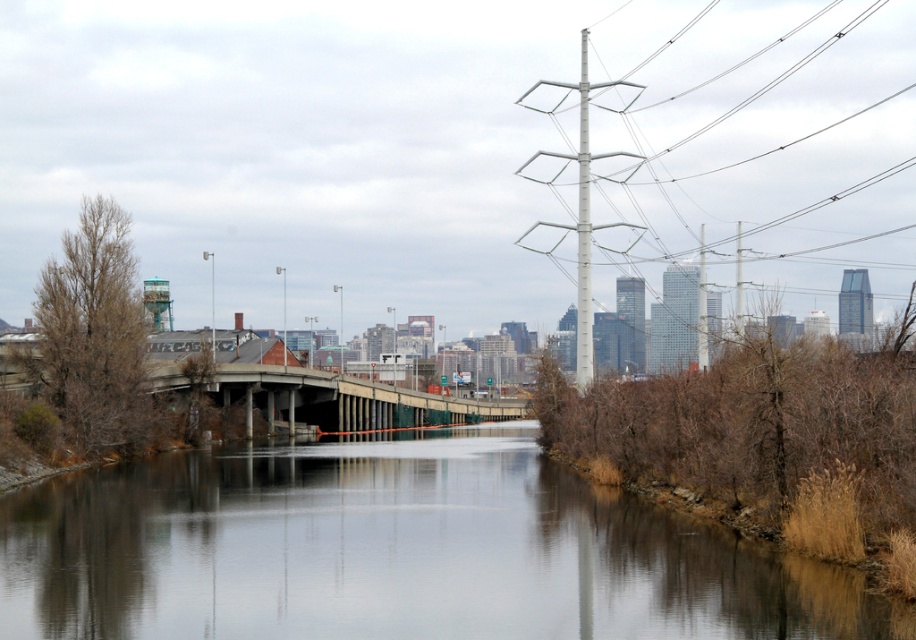
Can you confirm if smooth concrete river at center is wider than concrete bridge at center?

No.

Does point (74, 580) lie behind point (186, 372)?

No, it is in front of (186, 372).

Is point (628, 557) positioned before point (326, 413)?

Yes.

At what (x,y) coordinates should I click in order to perform the action: click on smooth concrete river at center. Please return your answer as a coordinate pair (x, y). Looking at the image, I should click on (398, 552).